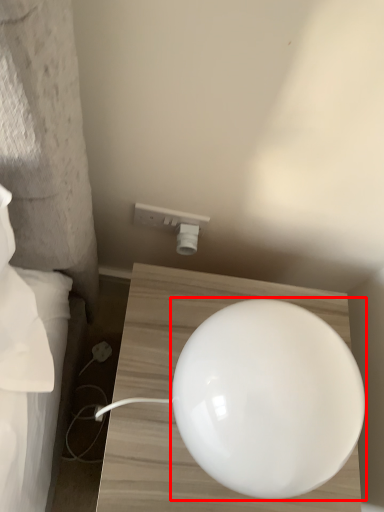
Question: From the image, what is the correct spatial relationship of lamp (annotated by the red box) in relation to electric outlet?

Choices:
 (A) right
 (B) left

Answer: (A)